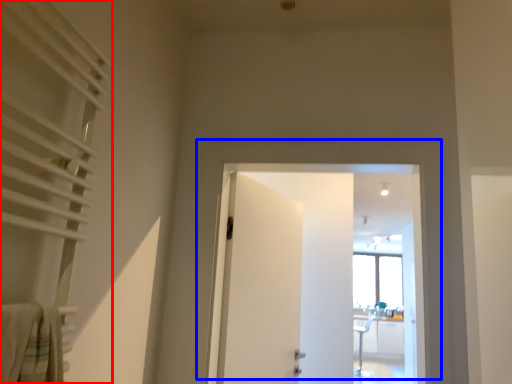
Question: Which point is further to the camera, curtain (highlighted by a red box) or door (highlighted by a blue box)?

Choices:
 (A) curtain
 (B) door

Answer: (B)